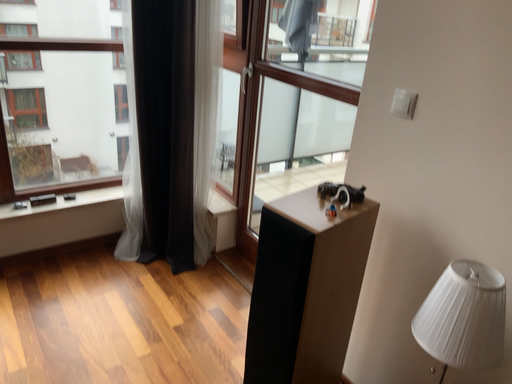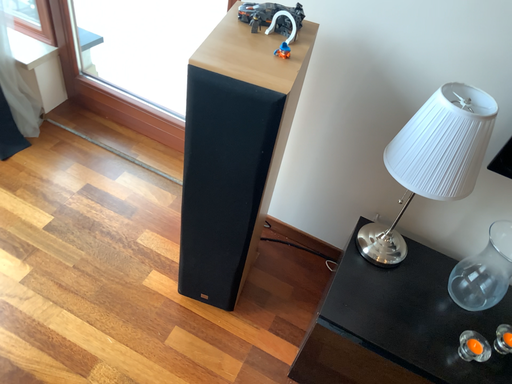
Question: Which way did the camera rotate in the video?

Choices:
 (A) rotated upward
 (B) rotated downward

Answer: (B)